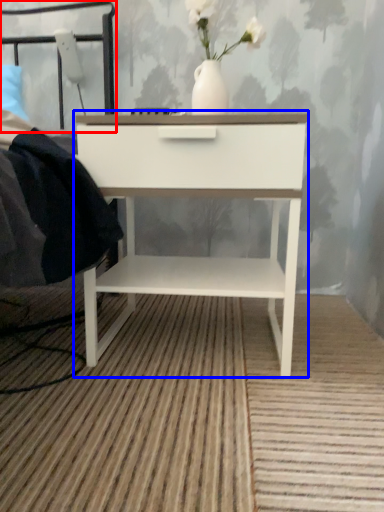
Question: Which object appears closest to the camera in this image, headboard (highlighted by a red box) or nightstand (highlighted by a blue box)?

Choices:
 (A) headboard
 (B) nightstand

Answer: (B)